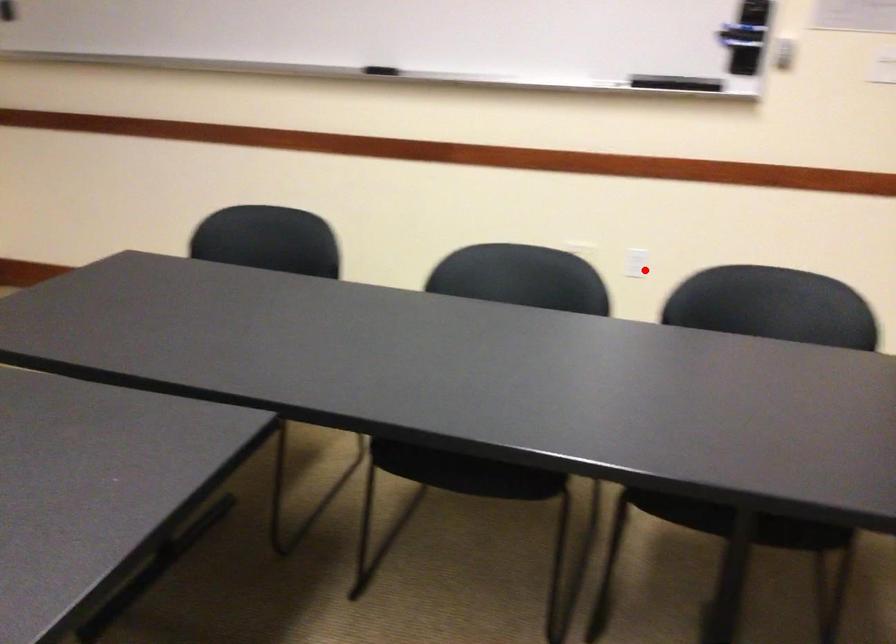
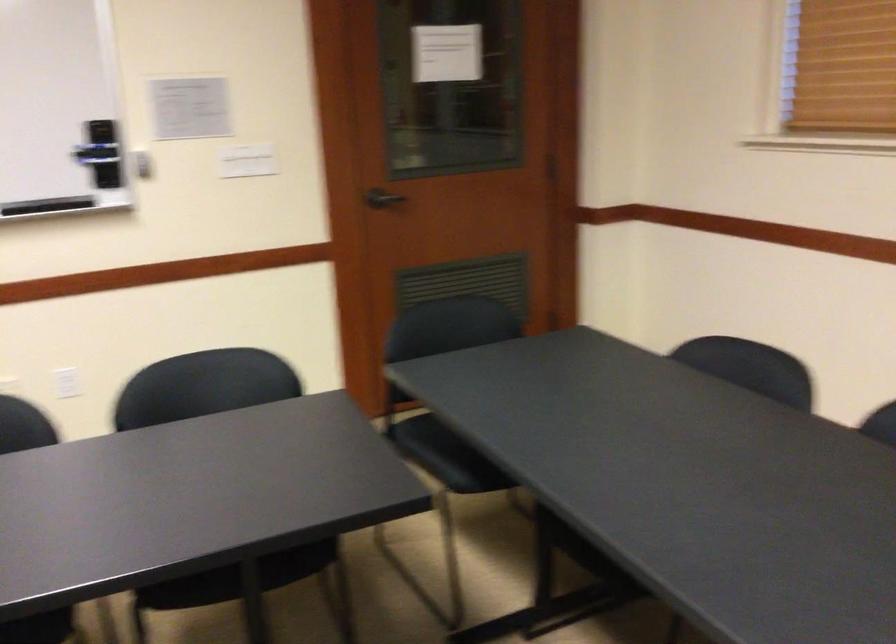
Find the pixel in the second image that matches the highlighted location in the first image.

(66, 383)